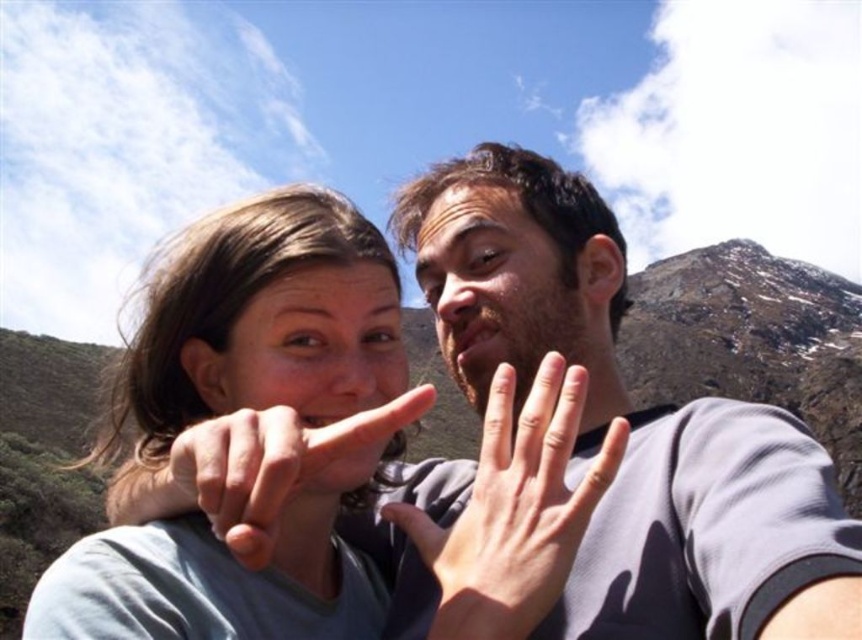
Question: Which point is farther to the camera?

Choices:
 (A) smooth skin hand at center
 (B) smooth skin finger at center
 (C) brown matte beard at center

Answer: (C)

Question: Which object is positioned closest to the matte gray shirt at center?

Choices:
 (A) matte skin face at center
 (B) smooth skin hand at center

Answer: (A)

Question: Where is matte gray shirt at center located in relation to smooth skin finger at center in the image?

Choices:
 (A) above
 (B) below

Answer: (A)

Question: Can you confirm if brown matte beard at center is positioned above smooth skin finger at center?

Choices:
 (A) yes
 (B) no

Answer: (A)

Question: Considering the relative positions of smooth skin hand at center and brown matte beard at center in the image provided, where is smooth skin hand at center located with respect to brown matte beard at center?

Choices:
 (A) right
 (B) left

Answer: (A)

Question: Which object is closer to the camera taking this photo?

Choices:
 (A) brown matte beard at center
 (B) smooth skin hand at center

Answer: (B)